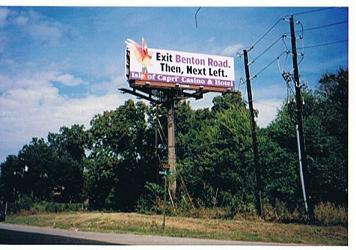
Where is `side bar`? Image resolution: width=356 pixels, height=250 pixels. side bar is located at coordinates tap(55, 237).